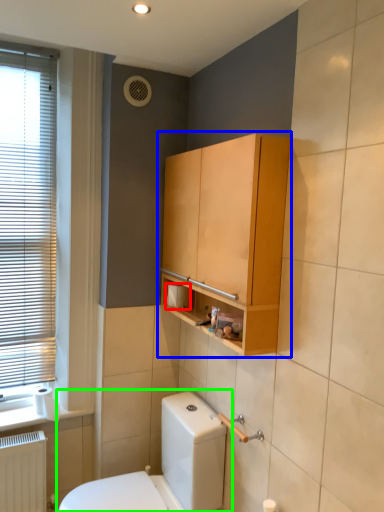
Question: Considering the real-world distances, which object is farthest from toilet paper (highlighted by a red box)? bathroom cabinet (highlighted by a blue box) or toilet (highlighted by a green box)?

Choices:
 (A) bathroom cabinet
 (B) toilet

Answer: (B)